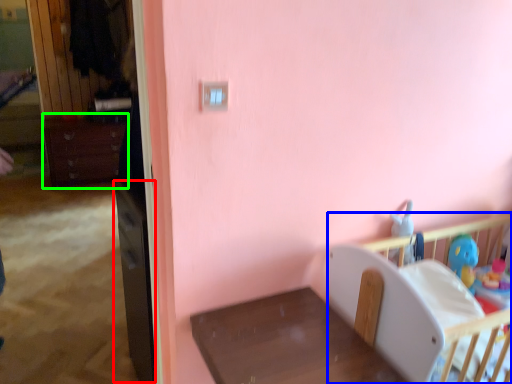
Question: Which is farther away from file cabinet (highlighted by a red box)? infant bed (highlighted by a blue box) or dresser (highlighted by a green box)?

Choices:
 (A) infant bed
 (B) dresser

Answer: (B)